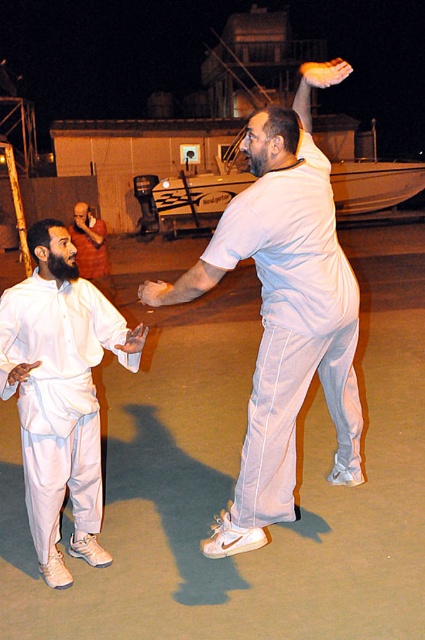
You are standing at the origin point of the coordinate system in the image. The white matte pants at center is located at point (286, 317). If you want to move towards the white matte pants at center, in which direction should you move?

The white matte pants at center is located at point (286, 317). Since the coordinate system typically uses x and y axes where increasing x is to the right and increasing y is downward, moving towards this point would require moving right and down from the origin.

You are observing two martial artists training on a dock at night. You notice two points marked in the scene. The first point is at coordinates point (210,189) and the second point is at point (150,282). From your perspective, which point is closer to you?

Point (150,282) is closer to you because the description states that point (210,189) is behind point (150,282).

You are a photographer trying to capture a closeup of the white matte pants at left and the matte white shirt at center during their martial arts practice. Since your camera can only focus on one object at a time, which object should you choose to ensure it appears larger in the photo?

The white matte pants at left is bigger than the matte white shirt at center, so you should choose to focus on the white matte pants at left to ensure it appears larger in the photo.